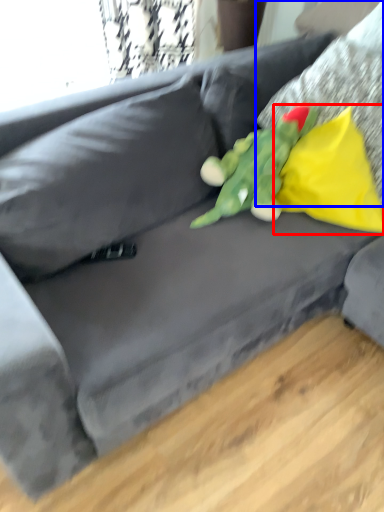
Question: Which object is closer to the camera taking this photo, pillow (highlighted by a red box) or pillow (highlighted by a blue box)?

Choices:
 (A) pillow
 (B) pillow

Answer: (B)